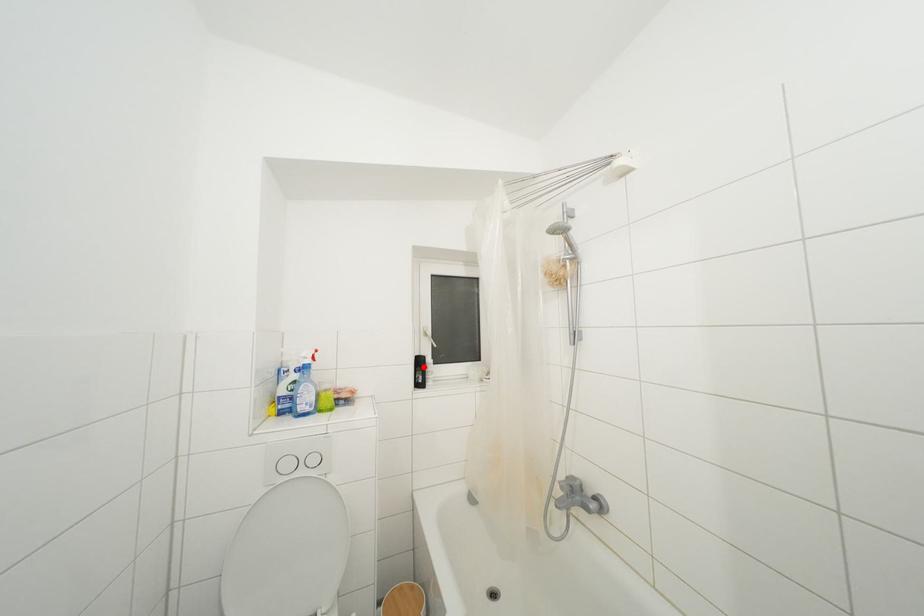
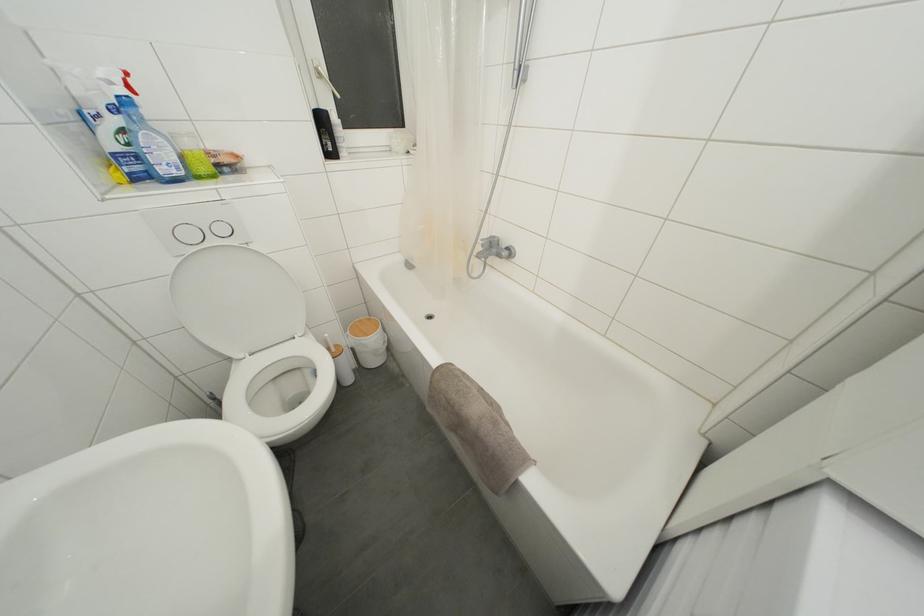
In the second image, find the point that corresponds to the highlighted location in the first image.

(325, 126)